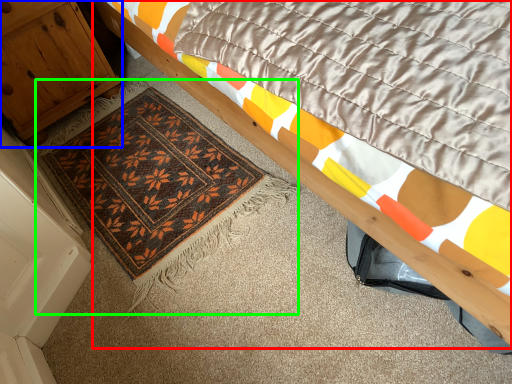
Question: Considering the real-world distances, which object is farthest from bed (highlighted by a red box)? cabinetry (highlighted by a blue box) or mat (highlighted by a green box)?

Choices:
 (A) cabinetry
 (B) mat

Answer: (A)